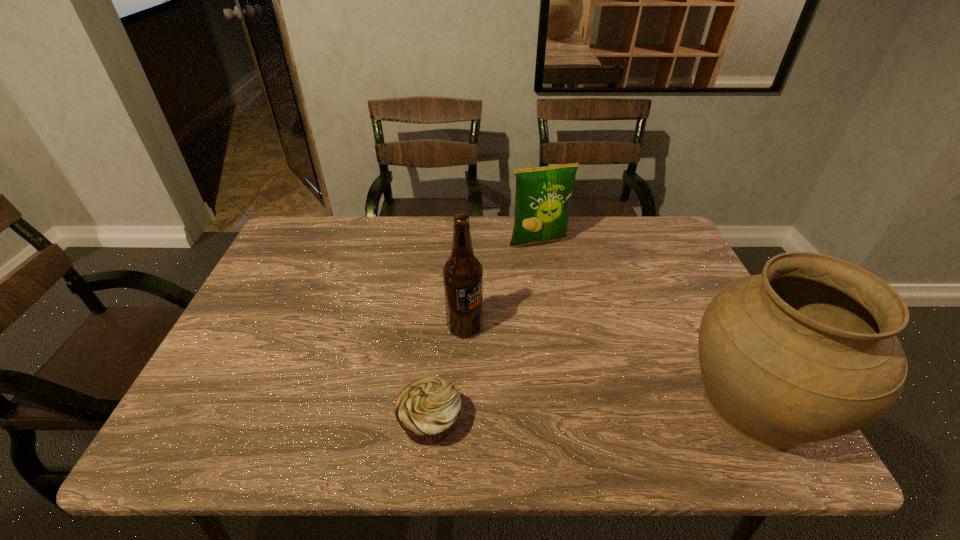
At what (x,y) coordinates should I click in order to perform the action: click on vacant space on the desktop that is between the muffin and the rightmost object and is positioned on the front-facing side of the third tallest object. Please return your answer as a coordinate pair (x, y). Image resolution: width=960 pixels, height=540 pixels. Looking at the image, I should click on (636, 410).

What are the coordinates of `vacant space on the desktop that is between the muffin and the urn and is positioned on the label of the third nearest object` in the screenshot? It's located at (564, 414).